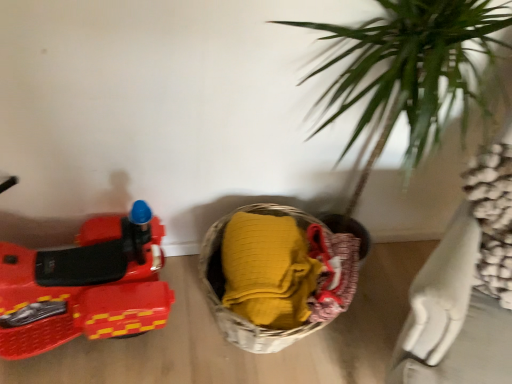
Identify the location of shiny plastic toy car at left. This screenshot has width=512, height=384. (84, 286).

Measure the distance between shiny plastic toy car at left and camera.

shiny plastic toy car at left is 3.55 feet away from camera.

Image resolution: width=512 pixels, height=384 pixels. What do you see at coordinates (84, 286) in the screenshot? I see `shiny plastic toy car at left` at bounding box center [84, 286].

You are a GUI agent. You are given a task and a screenshot of the screen. Output one action in this format:
    pyautogui.click(x=<x>, y=<y>)
    Task: Click on the woven fabric basket at lower center
    Image resolution: width=512 pixels, height=384 pixels.
    Given the screenshot: What is the action you would take?
    pyautogui.click(x=276, y=275)

Describe the element at coordinates (276, 275) in the screenshot. This screenshot has width=512, height=384. I see `woven fabric basket at lower center` at that location.

You are a GUI agent. You are given a task and a screenshot of the screen. Output one action in this format:
    pyautogui.click(x=<x>, y=<y>)
    Task: Click on the shiny plastic toy car at left
    This screenshot has width=512, height=384.
    Given the screenshot: What is the action you would take?
    pyautogui.click(x=84, y=286)

Would you say woven fabric basket at lower center is to the left or to the right of shiny plastic toy car at left in the picture?

From the image, it's evident that woven fabric basket at lower center is to the right of shiny plastic toy car at left.

Considering the positions of objects woven fabric basket at lower center and shiny plastic toy car at left in the image provided, who is behind, woven fabric basket at lower center or shiny plastic toy car at left?

woven fabric basket at lower center is more distant.

Which point is more distant from viewer, [240,224] or [32,264]?

The point [240,224] is farther from the camera.

Looking at this image, from the image's perspective, is woven fabric basket at lower center on shiny plastic toy car at left?

No.

From a real-world perspective, which object rests below the other?

In real-world perspective, woven fabric basket at lower center is lower.

Which of these two, woven fabric basket at lower center or shiny plastic toy car at left, is wider?

Wider between the two is woven fabric basket at lower center.

Can you confirm if woven fabric basket at lower center is taller than shiny plastic toy car at left?

Incorrect, the height of woven fabric basket at lower center is not larger of that of shiny plastic toy car at left.

Consider the image. Does woven fabric basket at lower center have a larger size compared to shiny plastic toy car at left?

No, woven fabric basket at lower center is not bigger than shiny plastic toy car at left.

Can we say woven fabric basket at lower center lies outside shiny plastic toy car at left?

Yes, woven fabric basket at lower center is located beyond the bounds of shiny plastic toy car at left.

Is the surface of woven fabric basket at lower center in direct contact with shiny plastic toy car at left?

No, woven fabric basket at lower center is not next to shiny plastic toy car at left.

In the scene shown: Is woven fabric basket at lower center facing away from shiny plastic toy car at left?

woven fabric basket at lower center does not have its back to shiny plastic toy car at left.

The height and width of the screenshot is (384, 512). There is a woven fabric basket at lower center. Identify the location of land vehicle above it (from a real-world perspective). (84, 286).

Which is more to the right, shiny plastic toy car at left or woven fabric basket at lower center?

woven fabric basket at lower center.

Which object is more forward, shiny plastic toy car at left or woven fabric basket at lower center?

shiny plastic toy car at left is in front.

Between point (132, 330) and point (261, 298), which one is positioned in front?

The point (261, 298) is more forward.

From the picture: From the image's perspective, is shiny plastic toy car at left below woven fabric basket at lower center?

No.

From a real-world perspective, is shiny plastic toy car at left positioned under woven fabric basket at lower center based on gravity?

No.

Which object is thinner, shiny plastic toy car at left or woven fabric basket at lower center?

shiny plastic toy car at left.

Between shiny plastic toy car at left and woven fabric basket at lower center, which one has less height?

With less height is woven fabric basket at lower center.

Considering the sizes of shiny plastic toy car at left and woven fabric basket at lower center in the image, is shiny plastic toy car at left bigger or smaller than woven fabric basket at lower center?

In the image, shiny plastic toy car at left appears to be larger than woven fabric basket at lower center.

Is shiny plastic toy car at left spatially inside woven fabric basket at lower center, or outside of it?

shiny plastic toy car at left is outside woven fabric basket at lower center.

Is shiny plastic toy car at left placed right next to woven fabric basket at lower center?

No, shiny plastic toy car at left is not in contact with woven fabric basket at lower center.

Could you tell me if shiny plastic toy car at left is turned towards woven fabric basket at lower center?

No, shiny plastic toy car at left is not oriented towards woven fabric basket at lower center.

What's the angular difference between shiny plastic toy car at left and woven fabric basket at lower center's facing directions?

There is a 2.6e-05-degree angle between the facing directions of shiny plastic toy car at left and woven fabric basket at lower center.

Image resolution: width=512 pixels, height=384 pixels. Identify the location of land vehicle above the woven fabric basket at lower center (from the image's perspective). (84, 286).

Where is `land vehicle located on the left of woven fabric basket at lower center`? The height and width of the screenshot is (384, 512). land vehicle located on the left of woven fabric basket at lower center is located at coordinates (84, 286).

I want to click on basket below the shiny plastic toy car at left (from the image's perspective), so (x=276, y=275).